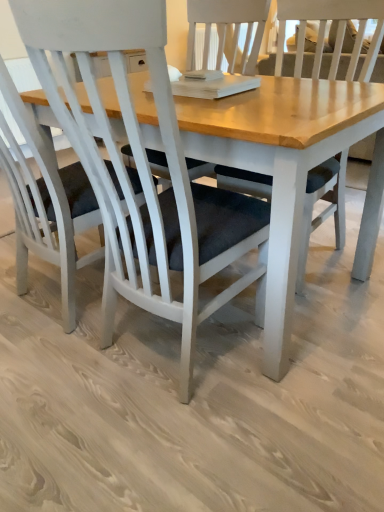
Describe the element at coordinates (46, 203) in the screenshot. I see `white matte chair at center, marked as the 1th chair in a left-to-right arrangement` at that location.

Identify the location of white matte chair at center, marked as the 1th chair in a left-to-right arrangement. The image size is (384, 512). (46, 203).

Locate an element on the screen. Image resolution: width=384 pixels, height=512 pixels. white matte chair at center, the 2th chair from the left is located at coordinates (143, 168).

The image size is (384, 512). Describe the element at coordinates (143, 168) in the screenshot. I see `white matte chair at center, which is counted as the 1th chair, starting from the right` at that location.

You are a GUI agent. You are given a task and a screenshot of the screen. Output one action in this format:
    pyautogui.click(x=<x>, y=<y>)
    Task: Click on the white matte chair at center, marked as the 2th chair in a right-to-left arrangement
    
    Given the screenshot: What is the action you would take?
    pyautogui.click(x=46, y=203)

Is white matte chair at center, which is counted as the 1th chair, starting from the right, to the left of white matte chair at center, marked as the 1th chair in a left-to-right arrangement, from the viewer's perspective?

Incorrect, white matte chair at center, which is counted as the 1th chair, starting from the right, is not on the left side of white matte chair at center, marked as the 1th chair in a left-to-right arrangement.

Is white matte chair at center, the 2th chair from the left, further to the viewer compared to white matte chair at center, marked as the 1th chair in a left-to-right arrangement?

No, white matte chair at center, the 2th chair from the left, is in front of white matte chair at center, marked as the 1th chair in a left-to-right arrangement.

Which is less distant, (95, 189) or (28, 113)?

Positioned in front is point (95, 189).

From the image's perspective, is white matte chair at center, which is counted as the 1th chair, starting from the right, located above white matte chair at center, marked as the 2th chair in a right-to-left arrangement?

No, from the image's perspective, white matte chair at center, which is counted as the 1th chair, starting from the right, is not above white matte chair at center, marked as the 2th chair in a right-to-left arrangement.

From a real-world perspective, is white matte chair at center, which is counted as the 1th chair, starting from the right, physically located above or below white matte chair at center, marked as the 2th chair in a right-to-left arrangement?

white matte chair at center, which is counted as the 1th chair, starting from the right, is below white matte chair at center, marked as the 2th chair in a right-to-left arrangement.

Between white matte chair at center, which is counted as the 1th chair, starting from the right, and white matte chair at center, marked as the 2th chair in a right-to-left arrangement, which one has smaller width?

white matte chair at center, which is counted as the 1th chair, starting from the right.

Can you confirm if white matte chair at center, the 2th chair from the left, is taller than white matte chair at center, marked as the 1th chair in a left-to-right arrangement?

No, white matte chair at center, the 2th chair from the left, is not taller than white matte chair at center, marked as the 1th chair in a left-to-right arrangement.

Is white matte chair at center, which is counted as the 1th chair, starting from the right, smaller than white matte chair at center, marked as the 1th chair in a left-to-right arrangement?

Indeed, white matte chair at center, which is counted as the 1th chair, starting from the right, has a smaller size compared to white matte chair at center, marked as the 1th chair in a left-to-right arrangement.

Is white matte chair at center, marked as the 1th chair in a left-to-right arrangement, a part of white matte chair at center, which is counted as the 1th chair, starting from the right?

No.

From the picture: Is white matte chair at center, the 2th chair from the left, touching white matte chair at center, marked as the 1th chair in a left-to-right arrangement?

No, white matte chair at center, the 2th chair from the left, is not next to white matte chair at center, marked as the 1th chair in a left-to-right arrangement.

Does white matte chair at center, which is counted as the 1th chair, starting from the right, turn towards white matte chair at center, marked as the 1th chair in a left-to-right arrangement?

No, white matte chair at center, which is counted as the 1th chair, starting from the right, does not turn towards white matte chair at center, marked as the 1th chair in a left-to-right arrangement.

How different are the orientations of white matte chair at center, the 2th chair from the left, and white matte chair at center, marked as the 2th chair in a right-to-left arrangement, in degrees?

The facing directions of white matte chair at center, the 2th chair from the left, and white matte chair at center, marked as the 2th chair in a right-to-left arrangement, are 0.000512 degrees apart.

Measure the distance between white matte chair at center, the 2th chair from the left, and white matte chair at center, marked as the 1th chair in a left-to-right arrangement.

white matte chair at center, the 2th chair from the left, and white matte chair at center, marked as the 1th chair in a left-to-right arrangement, are 11.54 inches apart.

I want to click on chair above the white matte chair at center, the 2th chair from the left (from a real-world perspective), so click(46, 203).

Considering the positions of objects white matte chair at center, marked as the 2th chair in a right-to-left arrangement, and white matte chair at center, the 2th chair from the left, in the image provided, who is more to the right, white matte chair at center, marked as the 2th chair in a right-to-left arrangement, or white matte chair at center, the 2th chair from the left,?

From the viewer's perspective, white matte chair at center, the 2th chair from the left, appears more on the right side.

Which object is closer to the camera taking this photo, white matte chair at center, marked as the 2th chair in a right-to-left arrangement, or white matte chair at center, the 2th chair from the left?

Positioned in front is white matte chair at center, the 2th chair from the left.

Is point (98, 216) positioned in front of point (207, 256)?

No, it is not.

From the image's perspective, is white matte chair at center, marked as the 1th chair in a left-to-right arrangement, below white matte chair at center, the 2th chair from the left?

No, from the image's perspective, white matte chair at center, marked as the 1th chair in a left-to-right arrangement, is not beneath white matte chair at center, the 2th chair from the left.

From a real-world perspective, does white matte chair at center, marked as the 2th chair in a right-to-left arrangement, sit lower than white matte chair at center, the 2th chair from the left?

No, from a real-world perspective, white matte chair at center, marked as the 2th chair in a right-to-left arrangement, is not under white matte chair at center, the 2th chair from the left.

In terms of width, does white matte chair at center, marked as the 1th chair in a left-to-right arrangement, look wider or thinner when compared to white matte chair at center, the 2th chair from the left?

white matte chair at center, marked as the 1th chair in a left-to-right arrangement, is wider than white matte chair at center, the 2th chair from the left.

Is white matte chair at center, marked as the 2th chair in a right-to-left arrangement, taller than white matte chair at center, the 2th chair from the left?

Correct, white matte chair at center, marked as the 2th chair in a right-to-left arrangement, is much taller as white matte chair at center, the 2th chair from the left.

In the scene shown: Considering the sizes of objects white matte chair at center, marked as the 1th chair in a left-to-right arrangement, and white matte chair at center, which is counted as the 1th chair, starting from the right, in the image provided, who is smaller, white matte chair at center, marked as the 1th chair in a left-to-right arrangement, or white matte chair at center, which is counted as the 1th chair, starting from the right,?

white matte chair at center, which is counted as the 1th chair, starting from the right, is smaller.

Would you say white matte chair at center, the 2th chair from the left, is part of white matte chair at center, marked as the 1th chair in a left-to-right arrangement,'s contents?

No, white matte chair at center, the 2th chair from the left, is not surrounded by white matte chair at center, marked as the 1th chair in a left-to-right arrangement.

Does white matte chair at center, marked as the 1th chair in a left-to-right arrangement, touch white matte chair at center, the 2th chair from the left?

white matte chair at center, marked as the 1th chair in a left-to-right arrangement, and white matte chair at center, the 2th chair from the left, are not in contact.

Is white matte chair at center, marked as the 2th chair in a right-to-left arrangement, aimed at white matte chair at center, the 2th chair from the left?

No, white matte chair at center, marked as the 2th chair in a right-to-left arrangement, is not facing towards white matte chair at center, the 2th chair from the left.

This screenshot has height=512, width=384. I want to click on chair that is above the white matte chair at center, the 2th chair from the left (from a real-world perspective), so click(46, 203).

I want to click on chair directly beneath the white matte chair at center, marked as the 1th chair in a left-to-right arrangement (from a real-world perspective), so click(x=143, y=168).

At what (x,y) coordinates should I click in order to perform the action: click on chair above the white matte chair at center, the 2th chair from the left (from a real-world perspective). Please return your answer as a coordinate pair (x, y). This screenshot has height=512, width=384. Looking at the image, I should click on (46, 203).